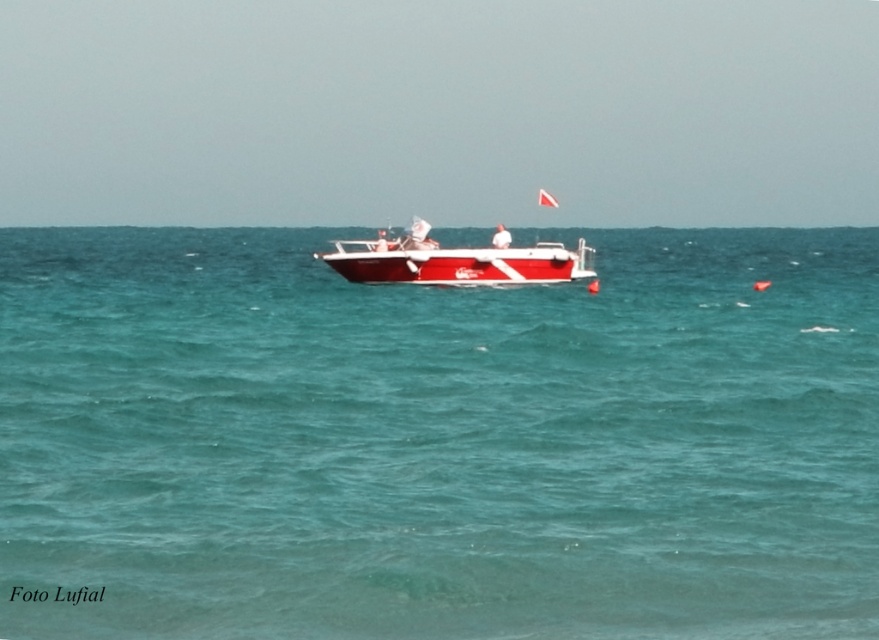
You are a photographer planning to capture the shiny red boat at center in the image. Since the teal glossy water at center is part of the scene, how does its size compare to the boat?

The teal glossy water at center is larger in size than the shiny red boat at center, so it occupies more of the frame compared to the boat.